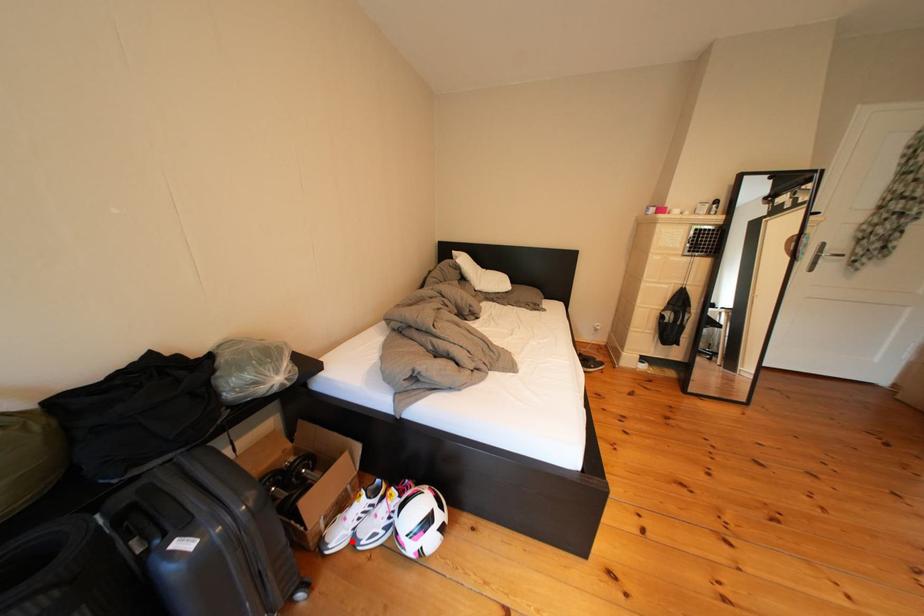
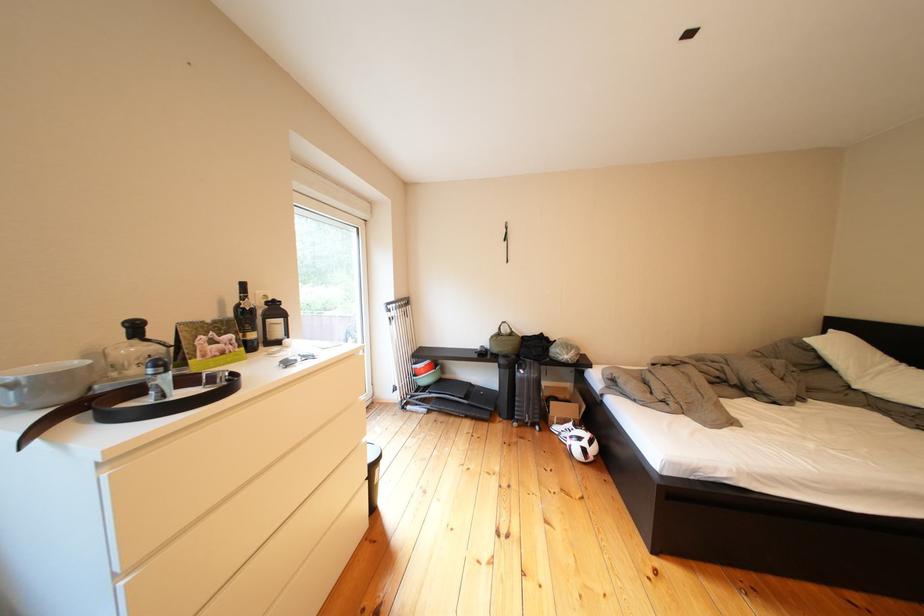
Find the pixel in the second image that matches the highlighted location in the first image.

(570, 432)